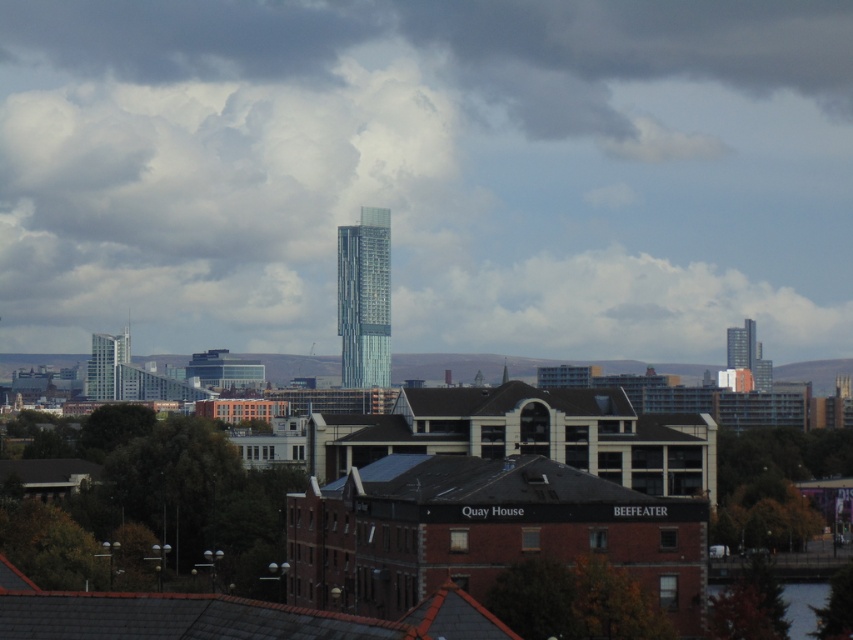
Which is in front, point (123, 84) or point (755, 339)?

Point (755, 339)

Is cloudy sky at center to the right of glassy steel tower at upper right from the viewer's perspective?

In fact, cloudy sky at center is to the left of glassy steel tower at upper right.

Between point (851, 340) and point (728, 336), which one is positioned in front?

Point (728, 336) is in front.

Where is `cloudy sky at center`? cloudy sky at center is located at coordinates (428, 173).

How far apart are cloudy sky at center and glassy steel tower at left?

cloudy sky at center is 63.05 meters away from glassy steel tower at left.

Is point (51, 138) more distant than point (114, 349)?

That is True.

Identify the location of cloudy sky at center. (428, 173).

Between point (389, 285) and point (94, 352), which one is positioned behind?

Positioned behind is point (94, 352).

Is glassy metallic skyscraper at center bigger than glassy steel tower at left?

Yes.

Identify the location of glassy metallic skyscraper at center. The height and width of the screenshot is (640, 853). (364, 298).